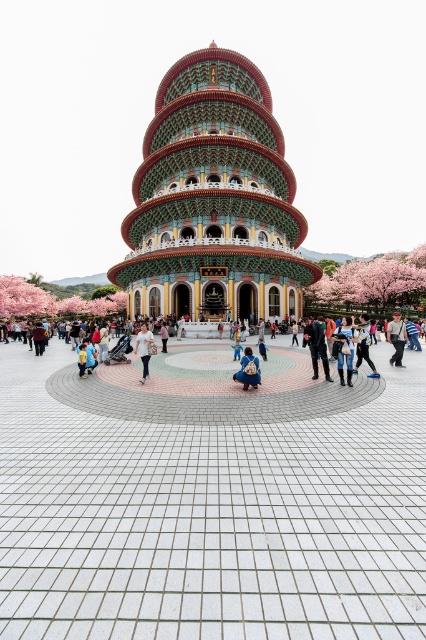
Does blue denim jacket at center have a lesser height compared to yellow fabric bag at center?

No.

Does point (247, 353) come farther from viewer compared to point (83, 346)?

No, it is not.

The image size is (426, 640). In order to click on blue denim jacket at center in this screenshot , I will do `click(247, 371)`.

Between white tiled plaza at center and dark blue fabric jacket at center, which one has more height?

dark blue fabric jacket at center

Where is `white tiled plaza at center`? Image resolution: width=426 pixels, height=640 pixels. white tiled plaza at center is located at coordinates (210, 518).

The height and width of the screenshot is (640, 426). Identify the location of white tiled plaza at center. (210, 518).

Can you confirm if dark blue fabric jacket at center is shorter than yellow fabric bag at center?

In fact, dark blue fabric jacket at center may be taller than yellow fabric bag at center.

Between dark blue fabric jacket at center and yellow fabric bag at center, which one is positioned lower?

yellow fabric bag at center is lower down.

The width and height of the screenshot is (426, 640). Find the location of `dark blue fabric jacket at center`. dark blue fabric jacket at center is located at coordinates (316, 346).

The image size is (426, 640). I want to click on dark blue fabric jacket at center, so click(316, 346).